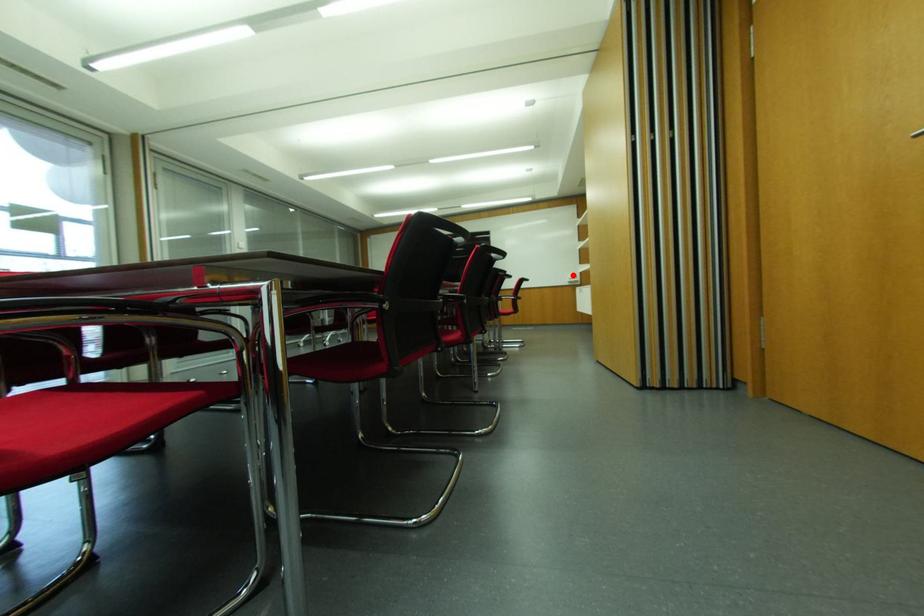
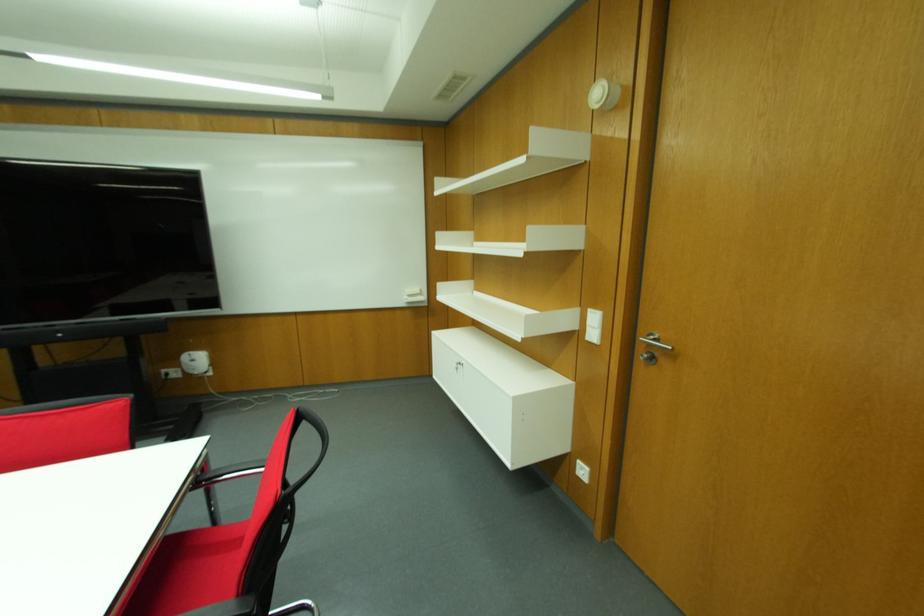
Where in the second image is the point corresponding to the highlighted location from the first image?

(416, 291)